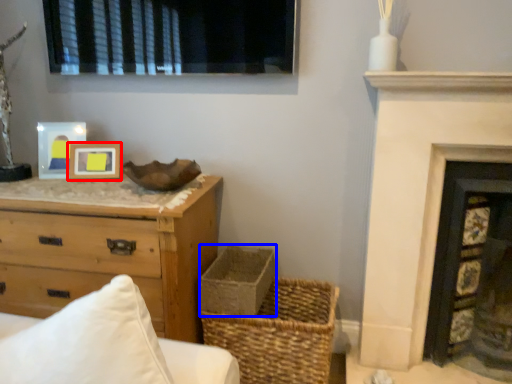
Question: Among these objects, which one is farthest to the camera, picture frame (highlighted by a red box) or basket container (highlighted by a blue box)?

Choices:
 (A) picture frame
 (B) basket container

Answer: (A)